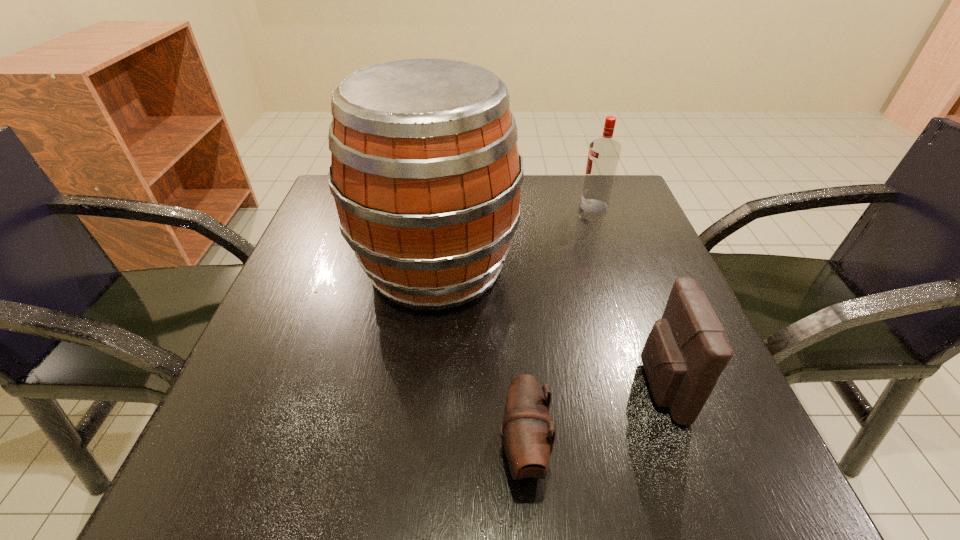
Locate an element on the screen. This screenshot has height=540, width=960. free region at the near right corner of the desktop is located at coordinates (747, 465).

Identify the location of free area in between the farthest object and the taller pouch. (627, 296).

At what (x,y) coordinates should I click in order to perform the action: click on free spot between the shorter pouch and the right pouch. Please return your answer as a coordinate pair (x, y). Looking at the image, I should click on (591, 418).

Find the location of a particular element. free space between the shortest object and the tallest object is located at coordinates pos(479,359).

The width and height of the screenshot is (960, 540). What are the coordinates of `free area in between the cider and the shorter pouch` in the screenshot? It's located at (479, 359).

Where is `unoccupied position between the shortest object and the third tallest object`? unoccupied position between the shortest object and the third tallest object is located at coordinates (591, 418).

Find the location of a particular element. The width and height of the screenshot is (960, 540). vacant area that lies between the right pouch and the second tallest object is located at coordinates (627, 296).

The image size is (960, 540). Identify the location of vacant space that is in between the shorter pouch and the second tallest object. (559, 329).

Locate an element on the screen. This screenshot has width=960, height=540. vacant space in between the taller pouch and the shortest object is located at coordinates (591, 418).

At what (x,y) coordinates should I click in order to perform the action: click on empty location between the cider and the farthest object. Please return your answer as a coordinate pair (x, y). Looking at the image, I should click on (515, 237).